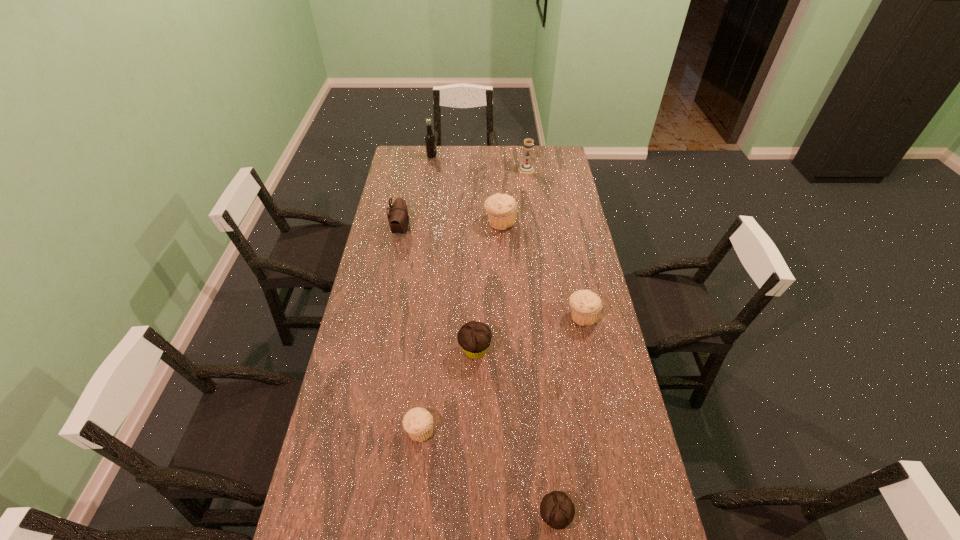
Find the location of a particular element. the farthest object is located at coordinates (430, 141).

At what (x,y) coordinates should I click in order to perform the action: click on the second object from left to right. Please return your answer as a coordinate pair (x, y). Looking at the image, I should click on (430, 141).

Locate an element on the screen. The height and width of the screenshot is (540, 960). the seventh nearest object is located at coordinates (x=526, y=168).

Identify the location of chalice. (526, 168).

In order to click on pouch in this screenshot , I will do `click(398, 218)`.

You are a GUI agent. You are given a task and a screenshot of the screen. Output one action in this format:
    pyautogui.click(x=<x>, y=<y>)
    Task: Click on the brown pouch
    This screenshot has width=960, height=540.
    Given the screenshot: What is the action you would take?
    pyautogui.click(x=398, y=218)

I want to click on the second beige muffin from right to left, so click(x=502, y=208).

Where is `the biggest beige muffin`? the biggest beige muffin is located at coordinates (502, 208).

You are a GUI agent. You are given a task and a screenshot of the screen. Output one action in this format:
    pyautogui.click(x=<x>, y=<y>)
    Task: Click on the rightmost muffin
    
    Given the screenshot: What is the action you would take?
    pyautogui.click(x=586, y=306)

The image size is (960, 540). I want to click on the rightmost object, so click(586, 306).